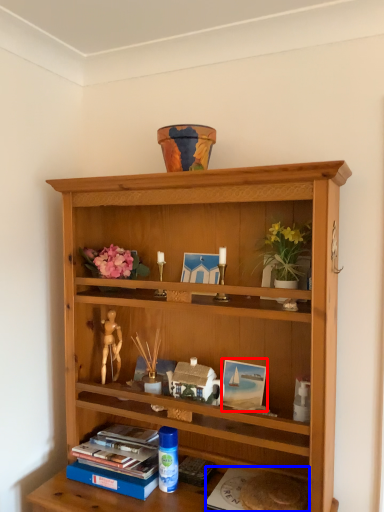
Question: Which object appears closest to the camera in this image, picture frame (highlighted by a red box) or paperback book (highlighted by a blue box)?

Choices:
 (A) picture frame
 (B) paperback book

Answer: (B)